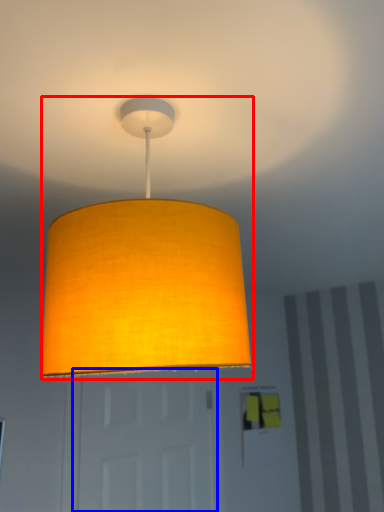
Question: Among these objects, which one is farthest to the camera, lamp (highlighted by a red box) or door (highlighted by a blue box)?

Choices:
 (A) lamp
 (B) door

Answer: (B)